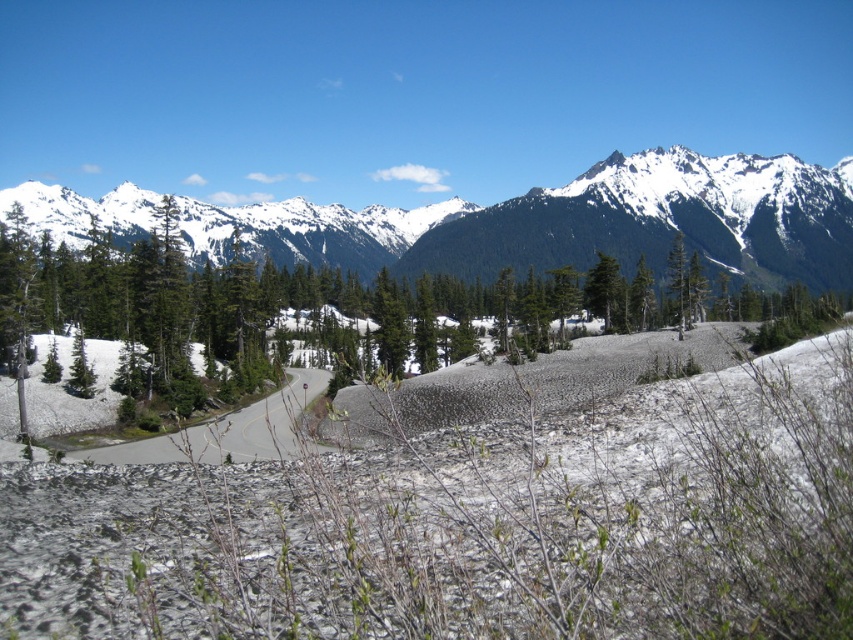
Question: Observing the image, what is the correct spatial positioning of snowy granite mountains at upper center in reference to asphalt road at center?

Choices:
 (A) below
 (B) above

Answer: (B)

Question: Estimate the real-world distances between objects in this image. Which object is farther from the snowy granite mountains at upper center?

Choices:
 (A) green textured pine at center
 (B) asphalt road at center

Answer: (B)

Question: Where is snowy granite mountains at upper center located in relation to asphalt road at center in the image?

Choices:
 (A) left
 (B) right

Answer: (B)

Question: Which of these objects is positioned closest to the snowy granite mountains at upper center?

Choices:
 (A) asphalt road at center
 (B) green textured pine at center

Answer: (B)

Question: Which point is closer to the camera?

Choices:
 (A) green textured pine at center
 (B) snowy granite mountains at upper center

Answer: (A)

Question: Is snowy granite mountains at upper center in front of asphalt road at center?

Choices:
 (A) yes
 (B) no

Answer: (B)